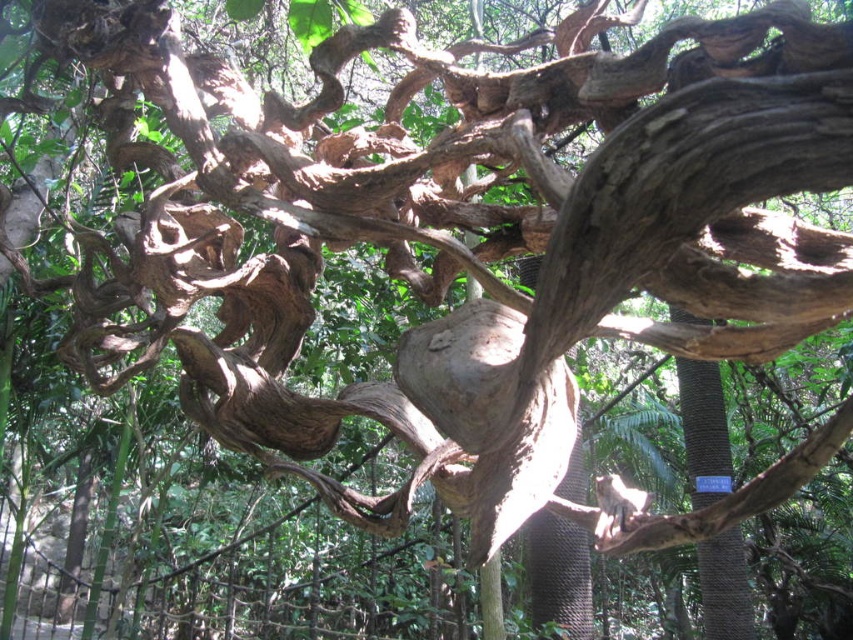
Does smooth brown bark at center have a greater width compared to brown rough textured tree trunk at center?

Correct, the width of smooth brown bark at center exceeds that of brown rough textured tree trunk at center.

Is smooth brown bark at center smaller than brown rough textured tree trunk at center?

No.

At what (x,y) coordinates should I click in order to perform the action: click on smooth brown bark at center. Please return your answer as a coordinate pair (x, y). Looking at the image, I should click on (704, 429).

This screenshot has height=640, width=853. In order to click on smooth brown bark at center in this screenshot , I will do (x=704, y=429).